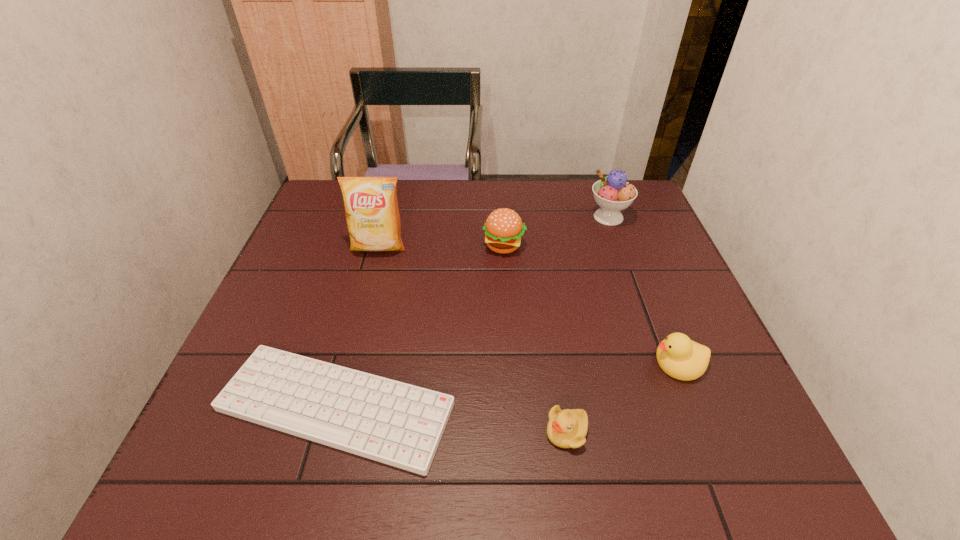
Identify the location of vacant space located 0.270m on the left of the farthest object. [497, 217].

I want to click on vacant area located 0.190m on the left of the fourth shortest object, so click(414, 246).

You are a GUI agent. You are given a task and a screenshot of the screen. Output one action in this format:
    pyautogui.click(x=<x>, y=<y>)
    Task: Click on the free location located 0.390m on the face of the right duckling
    This screenshot has width=960, height=540.
    Given the screenshot: What is the action you would take?
    tap(469, 363)

In order to click on free region located on the face of the right duckling in this screenshot , I will do point(483,363).

Find the location of a particular element. This screenshot has width=960, height=540. vacant area located on the face of the right duckling is located at coordinates (502, 363).

Locate an element on the screen. This screenshot has height=540, width=960. free space located on the beak of the shorter duckling is located at coordinates (482, 431).

You are a GUI agent. You are given a task and a screenshot of the screen. Output one action in this format:
    pyautogui.click(x=<x>, y=<y>)
    Task: Click on the vacant point located 0.360m on the beak of the shorter duckling
    The height and width of the screenshot is (540, 960).
    Given the screenshot: What is the action you would take?
    pyautogui.click(x=353, y=431)

Locate an element on the screen. This screenshot has height=540, width=960. blank area located on the beak of the shorter duckling is located at coordinates (519, 431).

Image resolution: width=960 pixels, height=540 pixels. What are the coordinates of `free region located on the back of the computer keyboard` in the screenshot? It's located at (358, 323).

You are a GUI agent. You are given a task and a screenshot of the screen. Output one action in this format:
    pyautogui.click(x=<x>, y=<y>)
    Task: Click on the object located in the far edge section of the desktop
    This screenshot has height=540, width=960.
    Given the screenshot: What is the action you would take?
    pyautogui.click(x=612, y=193)